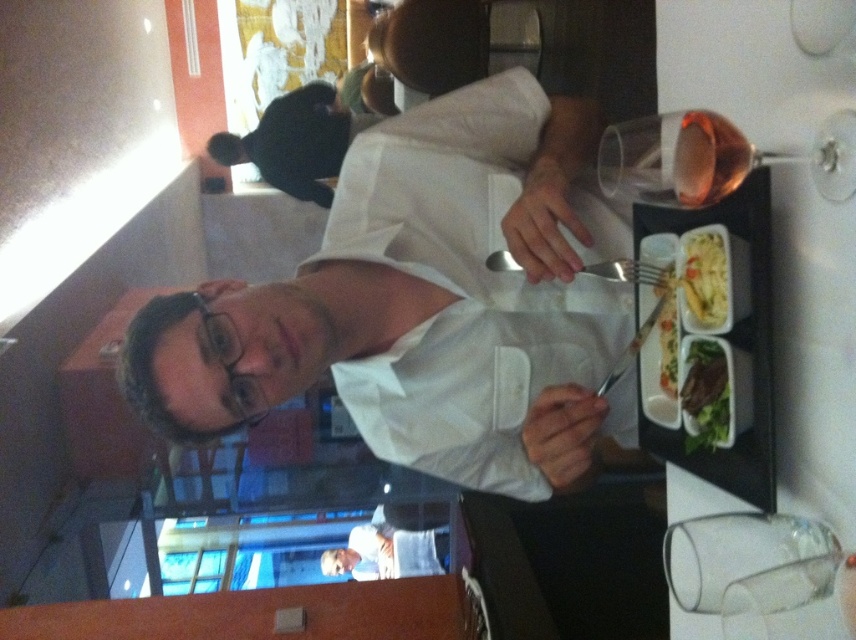
Based on the photo, you are a waiter in a restaurant and you see the silver metallic fork at center and the green leafy salad at upper right on the table. Which object is closer to the left side of the table?

The silver metallic fork at center is closer to the left side of the table since it is positioned to the left of the green leafy salad at upper right.

You are a photographer standing at a distance. You want to take a closeup shot of the white matte shirt at upper center. Based on the scene description, is the subject within your camera lens range if your camera can focus as close as 30 inches?

The white matte shirt at upper center is 32.65 inches away from viewer. Since the camera can focus as close as 30 inches, the subject is slightly out of the minimum focus range. You may need to step back or use a different lens setting.

You are a waiter in a restaurant and need to clear the table. The customer has finished their meal. Which item should you pick up first, the silver metallic fork at center or the green leafy salad at upper right, if you want to reach the one closer to you first?

The silver metallic fork at center is closer to the viewer than the green leafy salad at upper right, so you should pick up the silver metallic fork at center first.